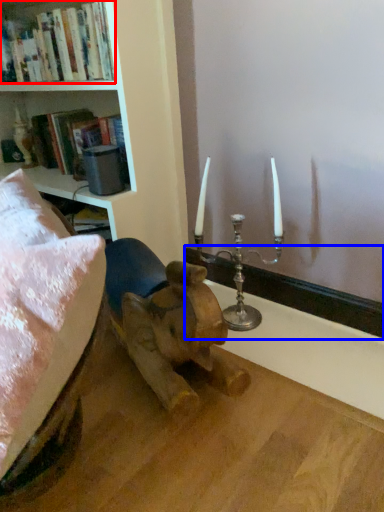
Question: Among these objects, which one is farthest to the camera, book (highlighted by a red box) or window sill (highlighted by a blue box)?

Choices:
 (A) book
 (B) window sill

Answer: (B)